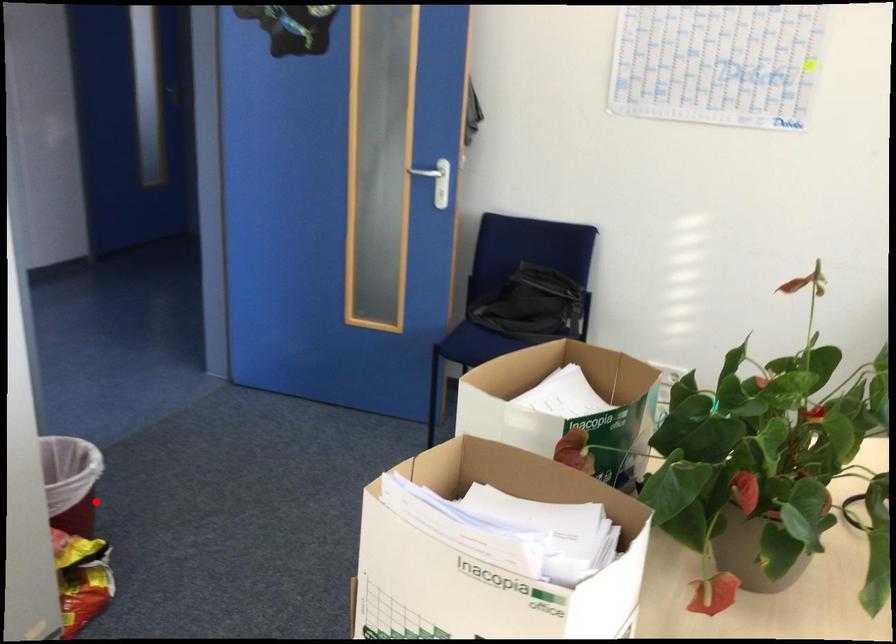
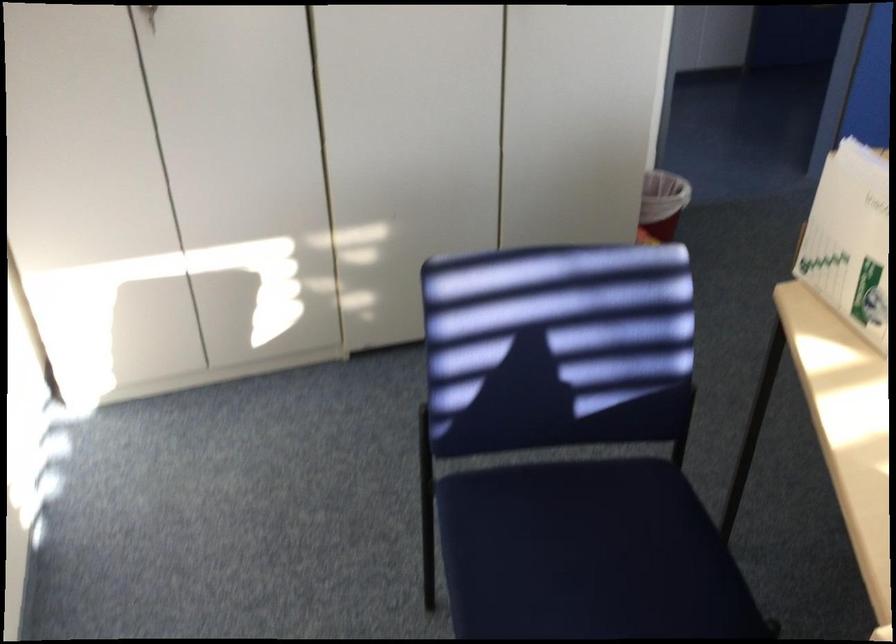
Where in the second image is the point corresponding to the highlighted location from the first image?

(661, 203)